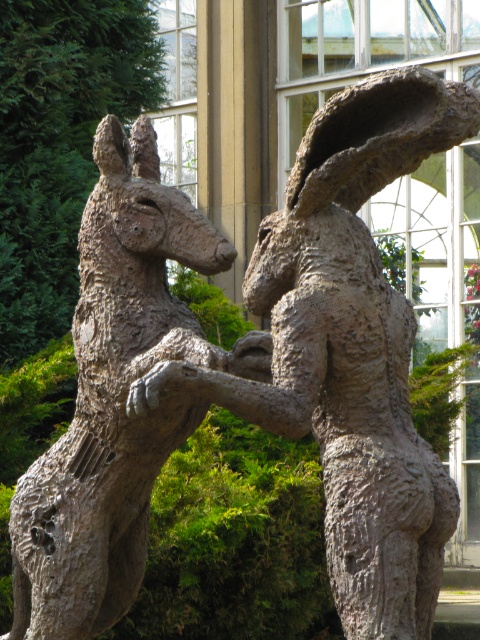
Between rough bronze sculpture at center and rustic stone kangaroo at center, which one is positioned lower?

rustic stone kangaroo at center is lower down.

This screenshot has width=480, height=640. Describe the element at coordinates (349, 349) in the screenshot. I see `rough bronze sculpture at center` at that location.

Does point (291, 259) come closer to viewer compared to point (104, 413)?

Yes, point (291, 259) is in front of point (104, 413).

Find the location of `rough bronze sculpture at center`. rough bronze sculpture at center is located at coordinates (349, 349).